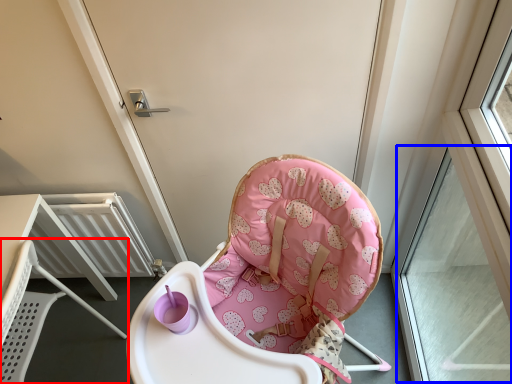
Question: Among these objects, which one is nearest to the camera, chair (highlighted by a red box) or window (highlighted by a blue box)?

Choices:
 (A) chair
 (B) window

Answer: (B)